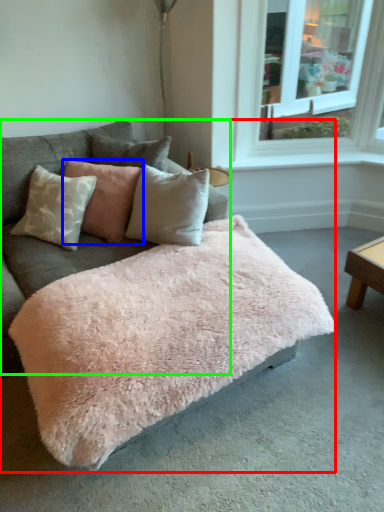
Question: Considering the real-world distances, which object is farthest from studio couch (highlighted by a red box)? pillow (highlighted by a blue box) or couch (highlighted by a green box)?

Choices:
 (A) pillow
 (B) couch

Answer: (A)